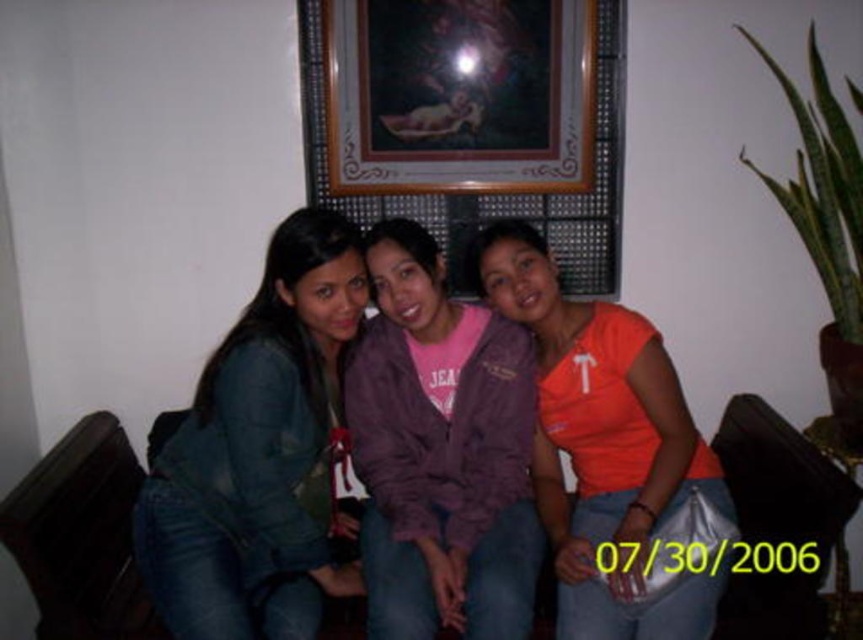
Question: In this image, where is denim jacket at center located relative to gold-framed painting at upper center?

Choices:
 (A) left
 (B) right

Answer: (A)

Question: Can you confirm if denim jacket at center is positioned above gold-framed painting at upper center?

Choices:
 (A) no
 (B) yes

Answer: (A)

Question: Can you confirm if denim jacket at center is positioned above orange matte shirt at center?

Choices:
 (A) yes
 (B) no

Answer: (A)

Question: Which point is farther to the camera?

Choices:
 (A) gold-framed painting at upper center
 (B) purple fleece jacket at center

Answer: (A)

Question: Which of the following is the closest to the observer?

Choices:
 (A) purple fleece jacket at center
 (B) denim jacket at center
 (C) orange matte shirt at center
 (D) gold-framed painting at upper center

Answer: (B)

Question: Which of these objects is positioned closest to the denim jacket at center?

Choices:
 (A) purple fleece jacket at center
 (B) gold-framed painting at upper center

Answer: (A)